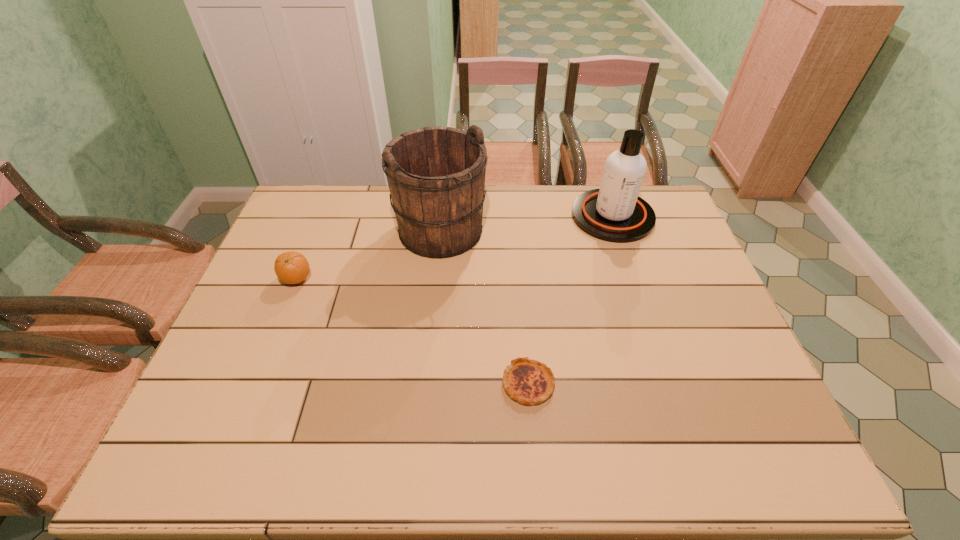
At what (x,y) coordinates should I click in order to perform the action: click on bucket positioned at the far edge. Please return your answer as a coordinate pair (x, y). This screenshot has width=960, height=540. Looking at the image, I should click on (436, 175).

Locate an element on the screen. cleansing agent at the far edge is located at coordinates (615, 213).

Identify the location of object that is at the left edge. (291, 267).

At what (x,y) coordinates should I click in order to perform the action: click on object that is at the right edge. Please return your answer as a coordinate pair (x, y). Image resolution: width=960 pixels, height=540 pixels. Looking at the image, I should click on (615, 213).

The width and height of the screenshot is (960, 540). Find the location of `object present at the far right corner`. object present at the far right corner is located at coordinates (615, 213).

What are the coordinates of `vacant region at the far edge` in the screenshot? It's located at (371, 205).

Identify the location of vacant space at the near edge of the desktop. The height and width of the screenshot is (540, 960). (620, 470).

Image resolution: width=960 pixels, height=540 pixels. I want to click on free space at the right edge of the desktop, so click(683, 288).

Locate an element on the screen. blank space at the far left corner of the desktop is located at coordinates (296, 211).

This screenshot has height=540, width=960. I want to click on vacant space that is in between the third object from right to left and the orange, so click(x=369, y=255).